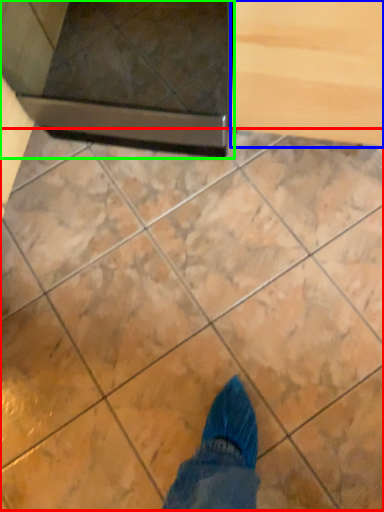
Question: Considering the real-world distances, which object is farthest from marble (highlighted by a red box)? drawer (highlighted by a blue box) or appliance (highlighted by a green box)?

Choices:
 (A) drawer
 (B) appliance

Answer: (A)